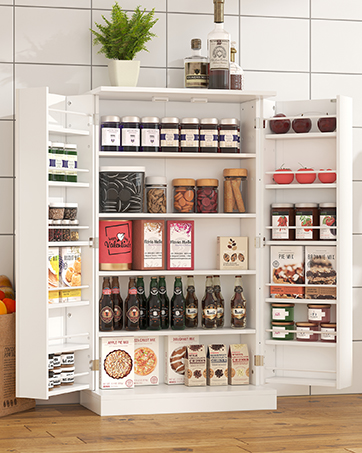
This screenshot has height=453, width=362. I want to click on items on top of shelves, so click(122, 77), click(196, 64), click(215, 50), click(234, 77).